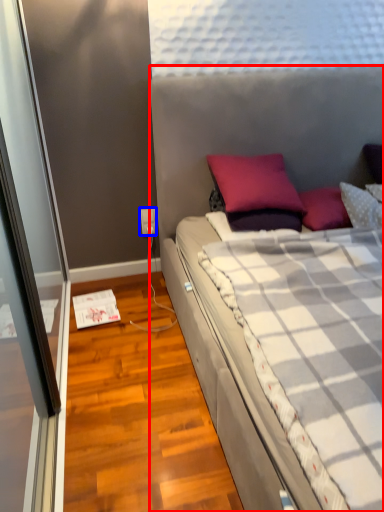
Question: Which object appears closest to the camera in this image, bed (highlighted by a red box) or power outlet (highlighted by a blue box)?

Choices:
 (A) bed
 (B) power outlet

Answer: (A)